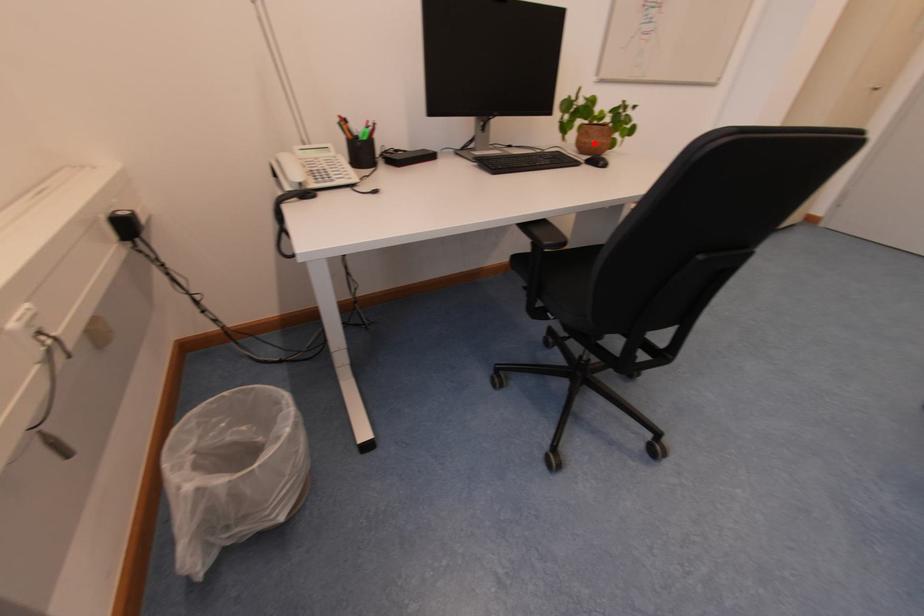
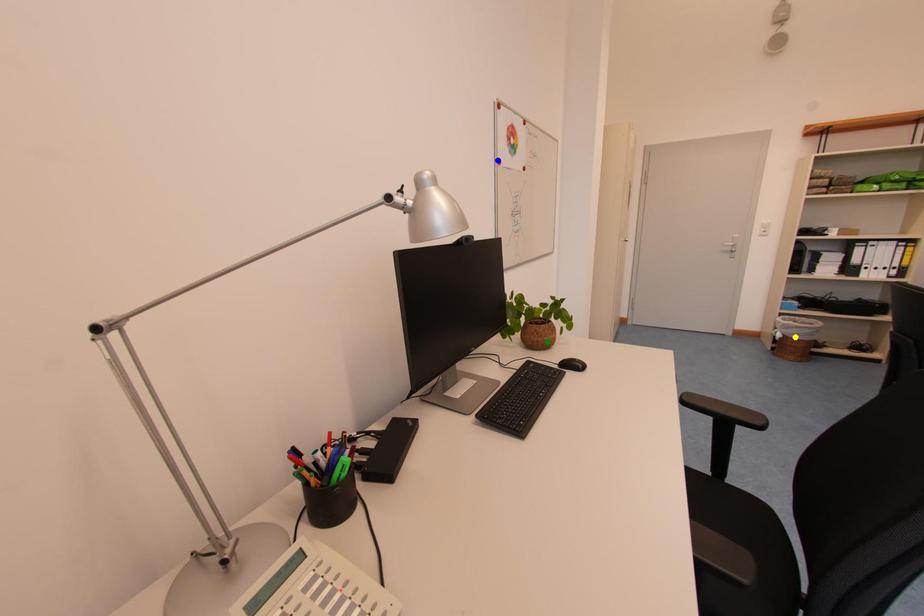
Question: I am providing you with two images of the same scene from different viewpoints. A red point is marked on the first image. You are given multiple points on the second image. Which point in image 2 is actually the same real-world point as the red point in image 1?

Choices:
 (A) green point
 (B) blue point
 (C) yellow point

Answer: (A)